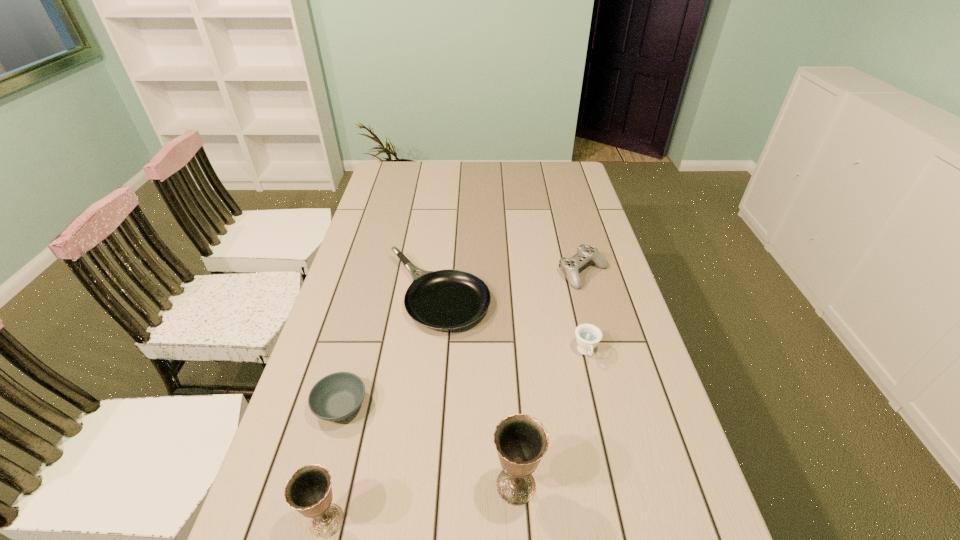
This screenshot has width=960, height=540. I want to click on vacant position located on the side of the fourth nearest object with the handle, so click(x=612, y=467).

Identify the location of blank space located 0.270m on the back of the soup bowl. The width and height of the screenshot is (960, 540). (368, 308).

At what (x,y) coordinates should I click in order to perform the action: click on object present at the near edge. Please return your answer as a coordinate pair (x, y). Looking at the image, I should click on (521, 440).

At what (x,y) coordinates should I click in order to perform the action: click on pan that is at the left edge. Please return your answer as a coordinate pair (x, y). This screenshot has height=540, width=960. Looking at the image, I should click on (449, 299).

The image size is (960, 540). In order to click on soup bowl located in the left edge section of the desktop in this screenshot , I will do `click(335, 397)`.

The width and height of the screenshot is (960, 540). What are the coordinates of `control located at the right edge` in the screenshot? It's located at (569, 266).

The width and height of the screenshot is (960, 540). I want to click on teacup situated at the right edge, so [587, 335].

Where is `free point at the far edge`? This screenshot has height=540, width=960. free point at the far edge is located at coordinates (544, 187).

Identify the location of vacant space at the left edge of the desktop. This screenshot has width=960, height=540. (385, 233).

You are a GUI agent. You are given a task and a screenshot of the screen. Output one action in this format:
    pyautogui.click(x=<x>, y=<y>)
    Task: Click on the free region at the right edge of the desktop
    The height and width of the screenshot is (540, 960).
    Given the screenshot: What is the action you would take?
    pyautogui.click(x=552, y=200)